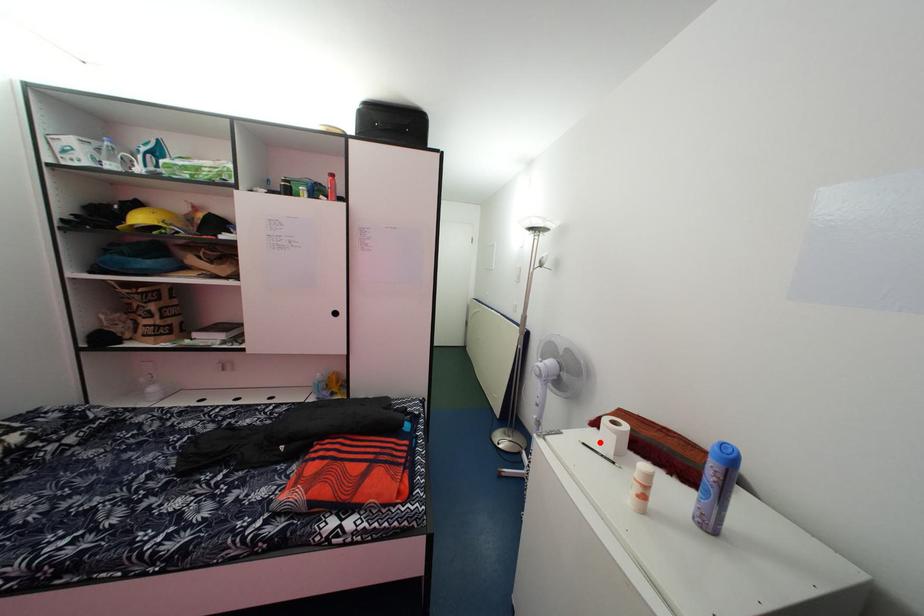
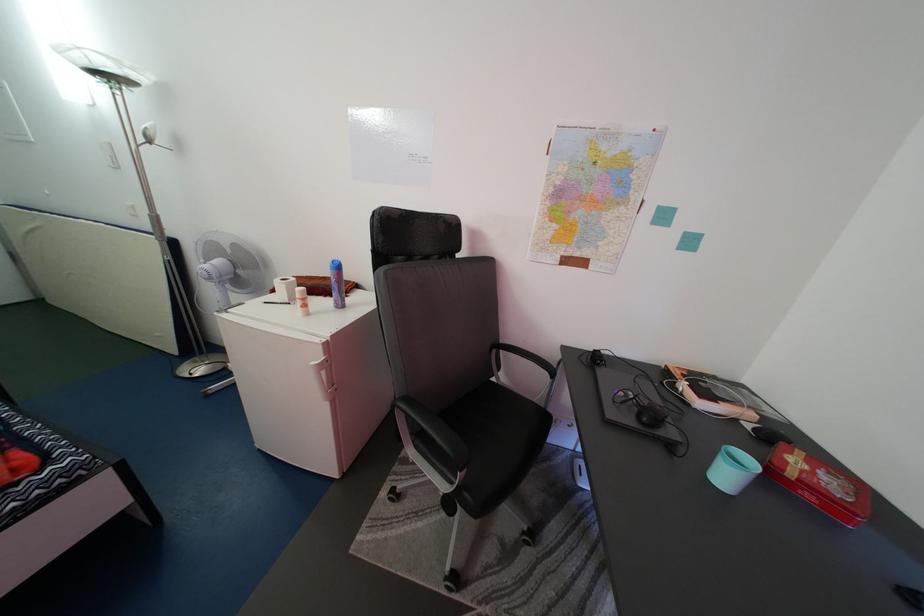
Find the pixel in the second image that matches the highlighted location in the first image.

(280, 304)